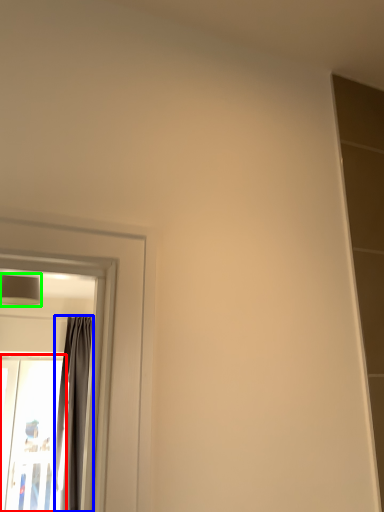
Question: Which is nearer to the screen door (highlighted by a red box)? curtain (highlighted by a blue box) or lamp (highlighted by a green box).

Choices:
 (A) curtain
 (B) lamp

Answer: (A)